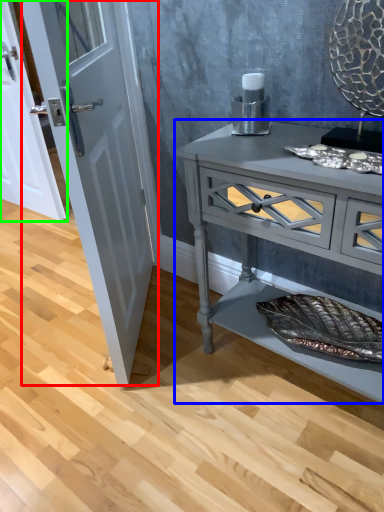
Question: Which object is the farthest from door (highlighted by a red box)? Choose among these: chest of drawers (highlighted by a blue box) or door (highlighted by a green box).

Choices:
 (A) chest of drawers
 (B) door

Answer: (B)